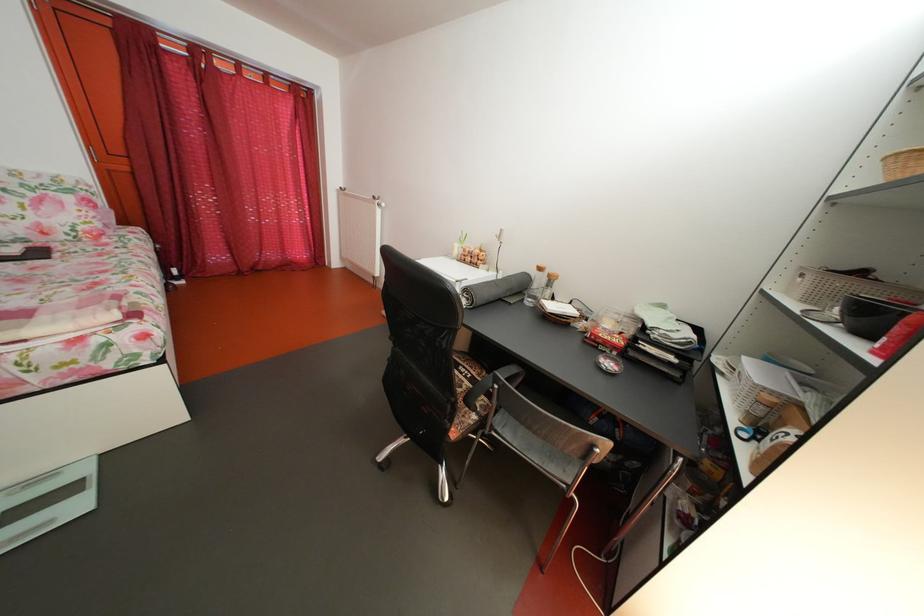
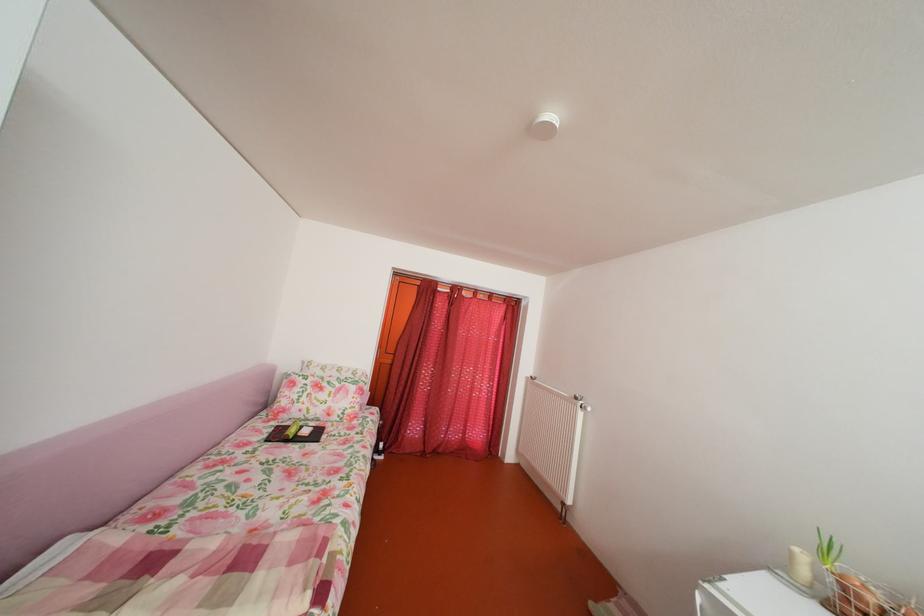
The point at (x=466, y=253) is marked in the first image. Where is the corresponding point in the second image?

(803, 561)